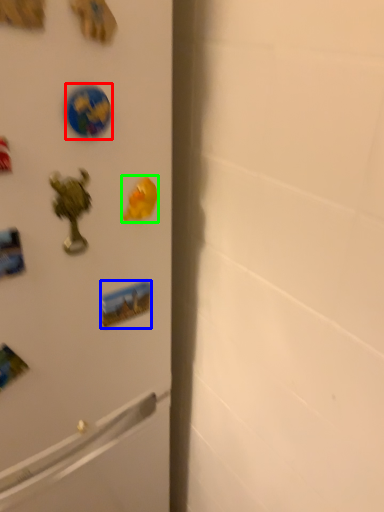
Question: Which is nearer to the sticker (highlighted by a red box)? sticker (highlighted by a blue box) or magnet (highlighted by a green box).

Choices:
 (A) sticker
 (B) magnet

Answer: (B)